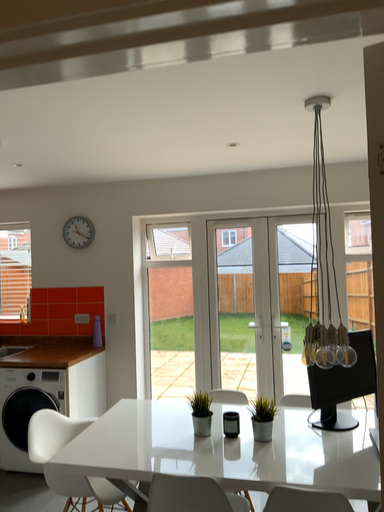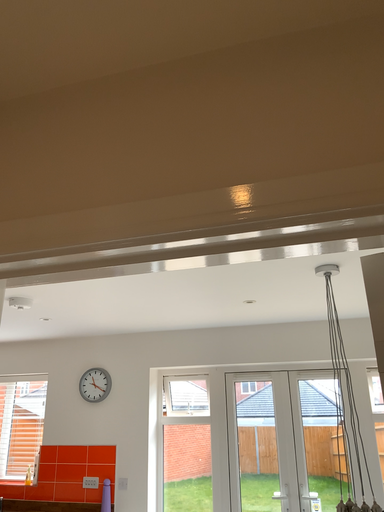
Question: Which way did the camera rotate in the video?

Choices:
 (A) rotated upward
 (B) rotated downward

Answer: (A)